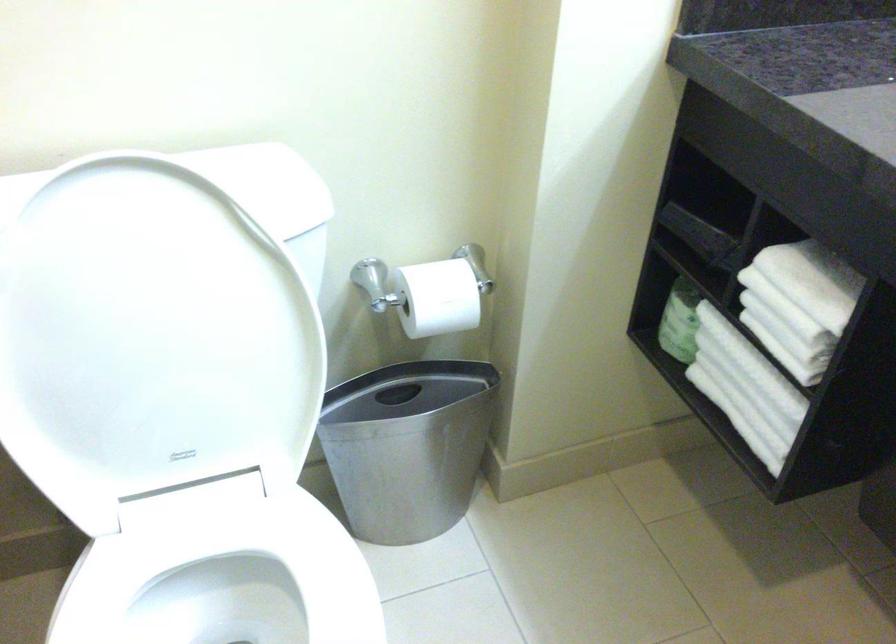
I want to click on small black box, so click(x=408, y=446).